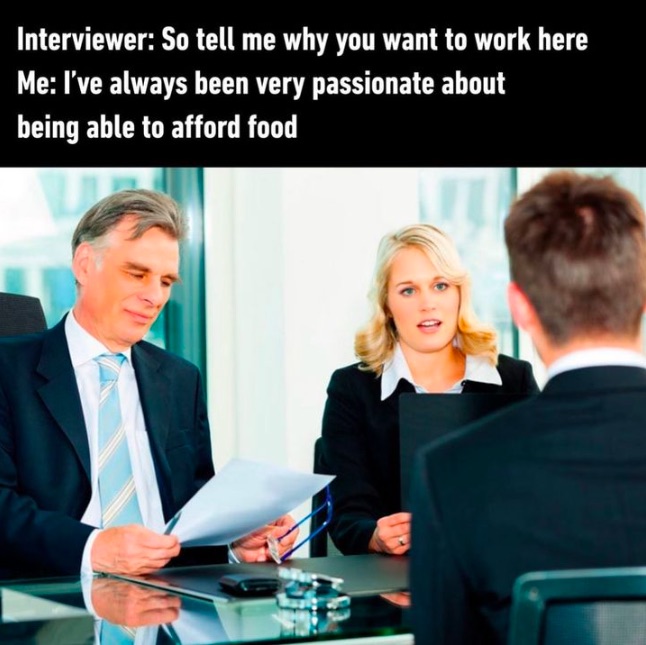
I want to click on desk chairs, so click(x=557, y=599), click(x=318, y=453), click(x=21, y=315).